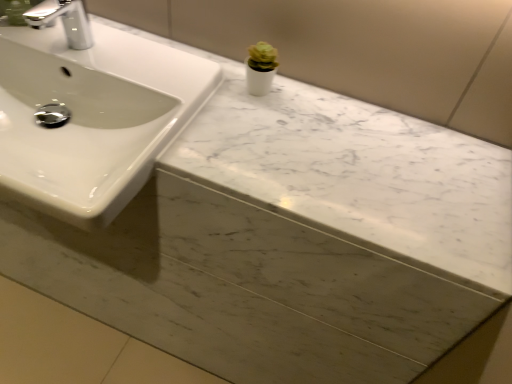
Find the location of a particular element. free space above white marble counter top at upper center (from a real-world perspective) is located at coordinates (267, 128).